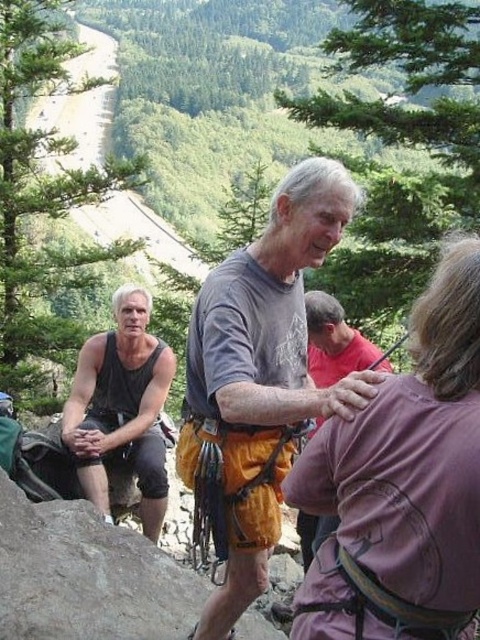
Which of these two, black mesh tank top at left or orange climbing harness at center, stands taller?

black mesh tank top at left

Based on the photo, is black mesh tank top at left taller than orange climbing harness at center?

Yes.

Where is `black mesh tank top at left`? black mesh tank top at left is located at coordinates (121, 406).

Find the location of a particular element. This screenshot has width=480, height=640. black mesh tank top at left is located at coordinates (121, 406).

Is gray cotton shirt at center closer to the viewer compared to black mesh tank top at left?

Yes, gray cotton shirt at center is in front of black mesh tank top at left.

Identify the location of gray cotton shirt at center. The width and height of the screenshot is (480, 640). (266, 332).

Can you confirm if gray cotton shirt at center is wider than orange climbing harness at center?

Yes.

Does gray cotton shirt at center appear on the left side of orange climbing harness at center?

Indeed, gray cotton shirt at center is positioned on the left side of orange climbing harness at center.

Is point (190, 372) in front of point (321, 378)?

Yes, it is in front of point (321, 378).

You are a GUI agent. You are given a task and a screenshot of the screen. Output one action in this format:
    pyautogui.click(x=<x>, y=<y>)
    Task: Click on the gray cotton shirt at center
    
    Given the screenshot: What is the action you would take?
    pyautogui.click(x=266, y=332)